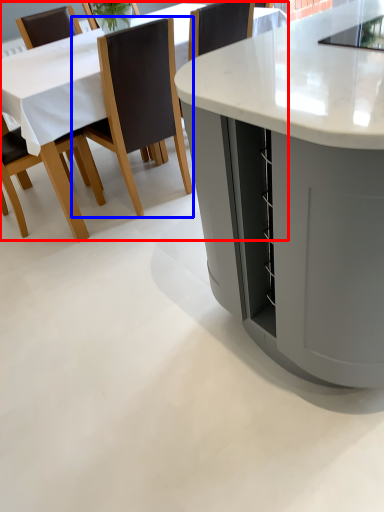
Question: Which object is further to the camera taking this photo, table (highlighted by a red box) or chair (highlighted by a blue box)?

Choices:
 (A) table
 (B) chair

Answer: (A)